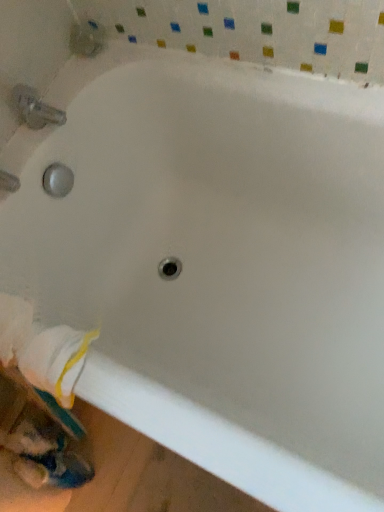
Find the location of `free space behind matte silver faucet at upper left`. free space behind matte silver faucet at upper left is located at coordinates (59, 80).